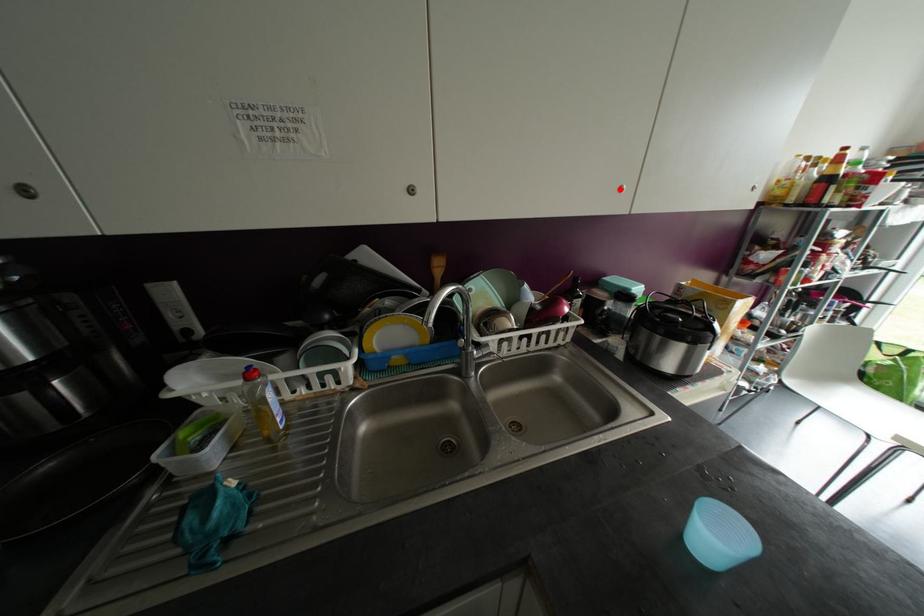
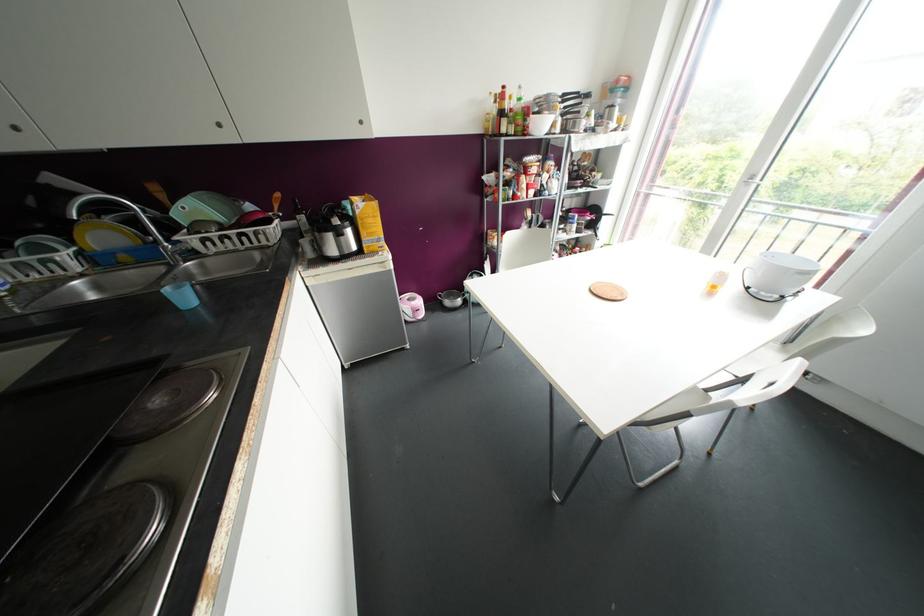
Question: I am providing you with two images of the same scene from different viewpoints. A red point is marked on the first image. Is the red point's position out of view in image 2?

Choices:
 (A) Yes
 (B) No

Answer: (B)